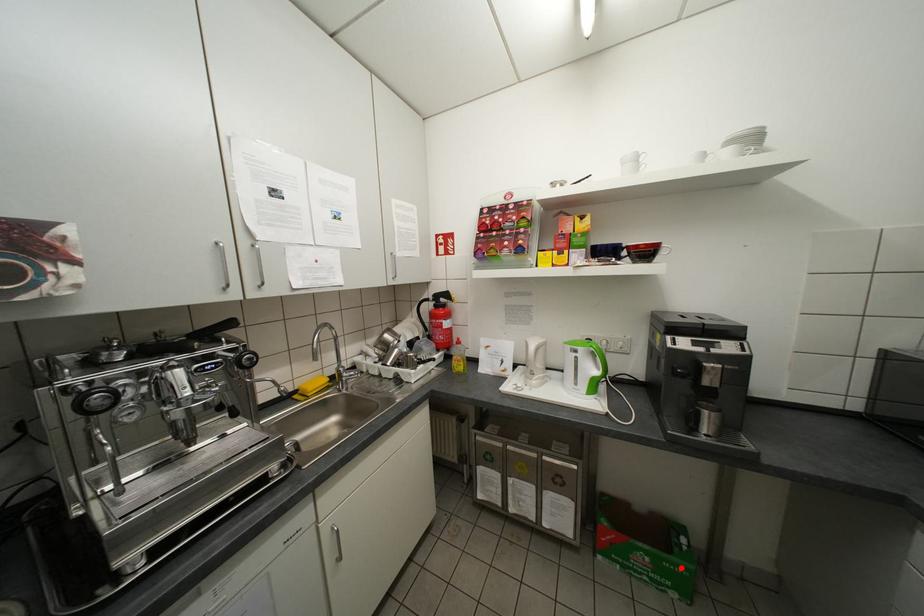
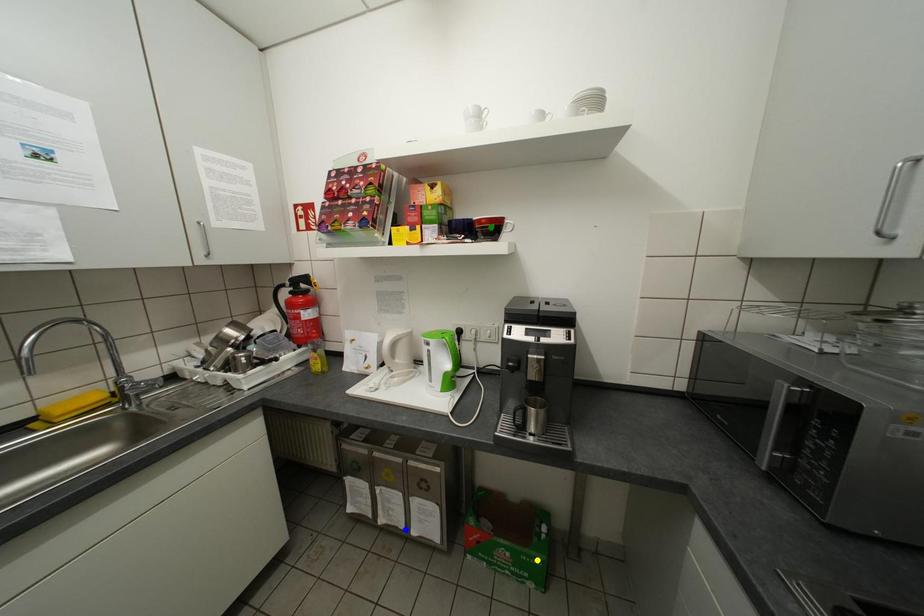
Question: I am providing you with two images of the same scene from different viewpoints. A red point is marked on the first image. You are given multiple points on the second image. Which point in image 2 represents the same 3d spot as the red point in image 1?

Choices:
 (A) green point
 (B) yellow point
 (C) blue point

Answer: (B)